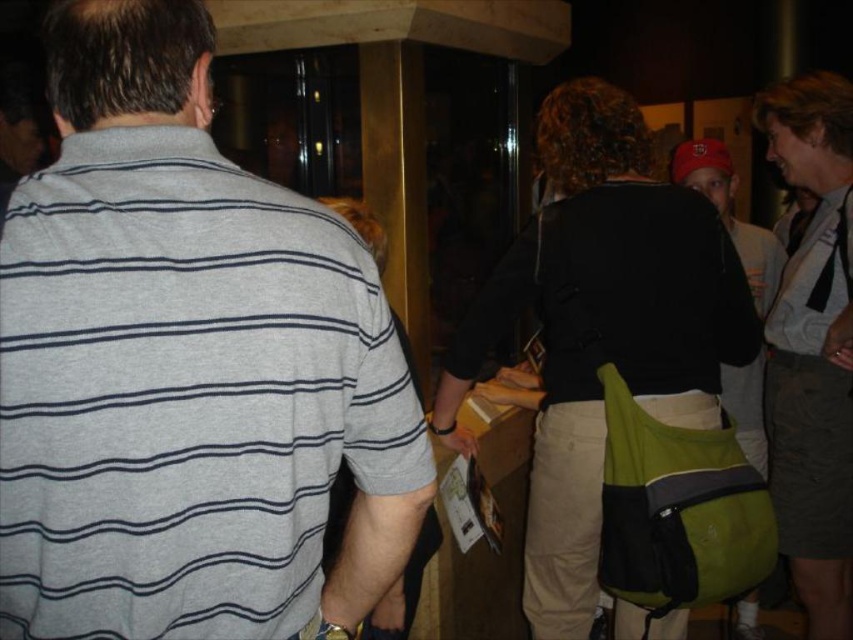
Looking at this image, you are standing in the lobby and need to locate the gray striped shirt at left and the green fabric backpack at center. Which object is positioned higher in the image?

The gray striped shirt at left is located above the green fabric backpack at center, so it is positioned higher in the image.

You are a photographer trying to capture a wide shot of the scene. The gray striped shirt at left and the green fabric backpack at center are in your frame. Which object takes up more space horizontally in the photo?

The green fabric backpack at center takes up more space horizontally in the photo because it has a greater width than the gray striped shirt at left.